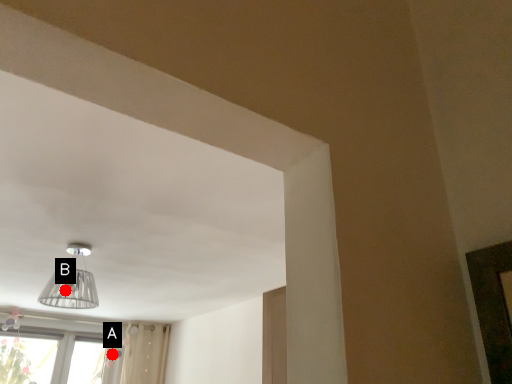
Question: Two points are circled on the image, labeled by A and B beside each circle. Which point is closer to the camera?

Choices:
 (A) A is closer
 (B) B is closer

Answer: (B)